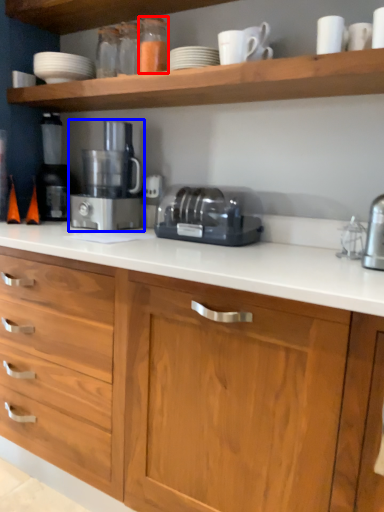
Question: Which point is further to the camera, bottle (highlighted by a red box) or home appliance (highlighted by a blue box)?

Choices:
 (A) bottle
 (B) home appliance

Answer: (B)